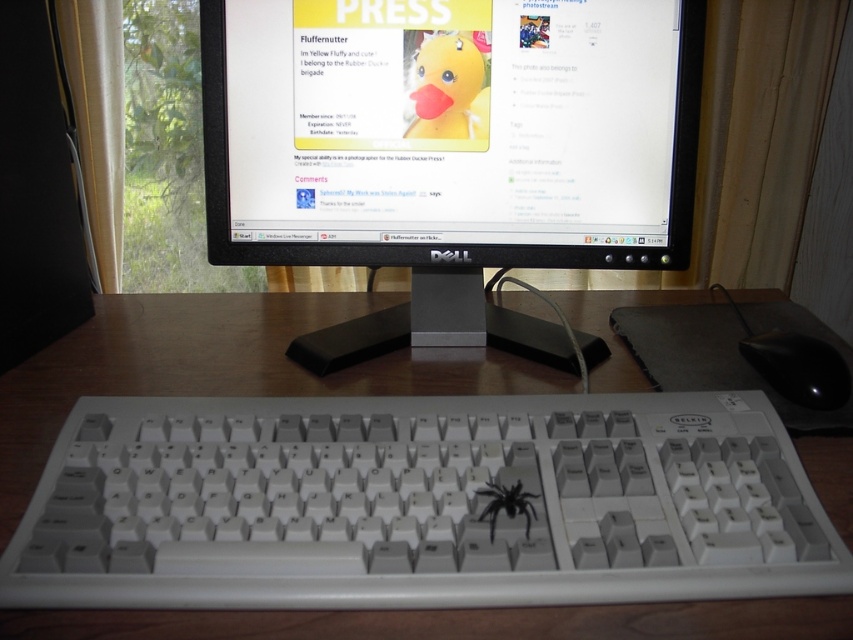
Question: Can you confirm if black glossy mouse at lower right is thinner than black matte spider at center?

Choices:
 (A) no
 (B) yes

Answer: (A)

Question: Which object is closer to the camera taking this photo?

Choices:
 (A) yellow matte rubber duck at center
 (B) black matte spider at center
 (C) wooden at center
 (D) black glossy mouse at lower right

Answer: (C)

Question: Can you confirm if wooden at center is thinner than black matte spider at center?

Choices:
 (A) no
 (B) yes

Answer: (A)

Question: Is yellow matte rubber duck at center bigger than black glossy mouse at lower right?

Choices:
 (A) yes
 (B) no

Answer: (A)

Question: Which point is closer to the camera?

Choices:
 (A) black glossy mouse at lower right
 (B) yellow matte rubber duck at center
 (C) black matte spider at center
 (D) wooden at center

Answer: (D)

Question: Which point appears closest to the camera in this image?

Choices:
 (A) (782, 339)
 (B) (419, 136)
 (C) (128, 624)

Answer: (C)